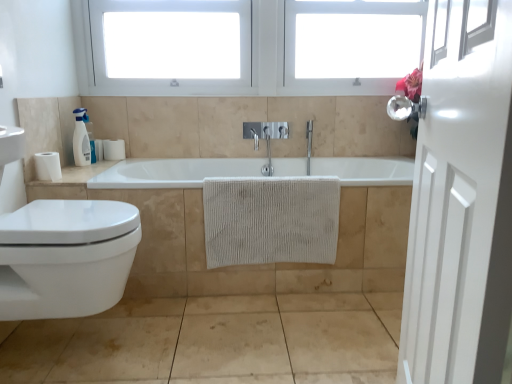
Question: Based on their positions, is beige textured towel at center located to the left or right of white glossy door at right?

Choices:
 (A) left
 (B) right

Answer: (A)

Question: Considering the positions of beige textured towel at center and white glossy door at right in the image, is beige textured towel at center taller or shorter than white glossy door at right?

Choices:
 (A) tall
 (B) short

Answer: (B)

Question: Estimate the real-world distances between objects in this image. Which object is closer to the white glossy soap dispenser at upper left?

Choices:
 (A) beige textured towel at center
 (B) white matte toilet paper at left, the first toilet paper viewed from the left
 (C) white glossy countertop at left
 (D) white textured towel at center
 (E) white glossy door at right

Answer: (C)

Question: Estimate the real-world distances between objects in this image. Which object is closer to the white plastic window at upper center, placed as the 2th window frame when sorted from right to left?

Choices:
 (A) white glossy soap dispenser at upper left
 (B) white glossy door at right
 (C) white textured towel at center
 (D) beige textured towel at center
 (E) white glossy toilet at lower left

Answer: (A)